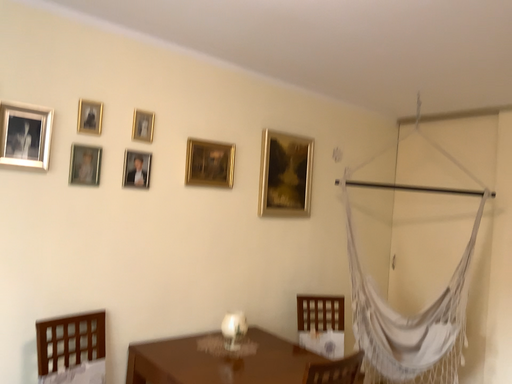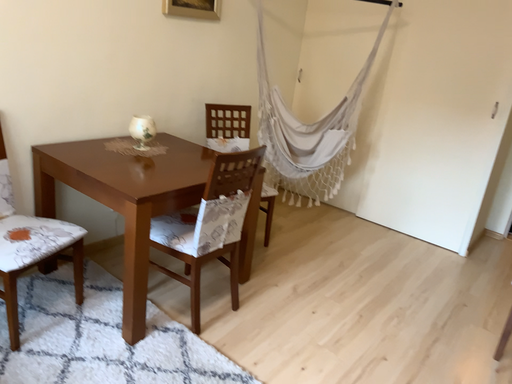
Question: How did the camera likely rotate when shooting the video?

Choices:
 (A) rotated right
 (B) rotated left

Answer: (A)